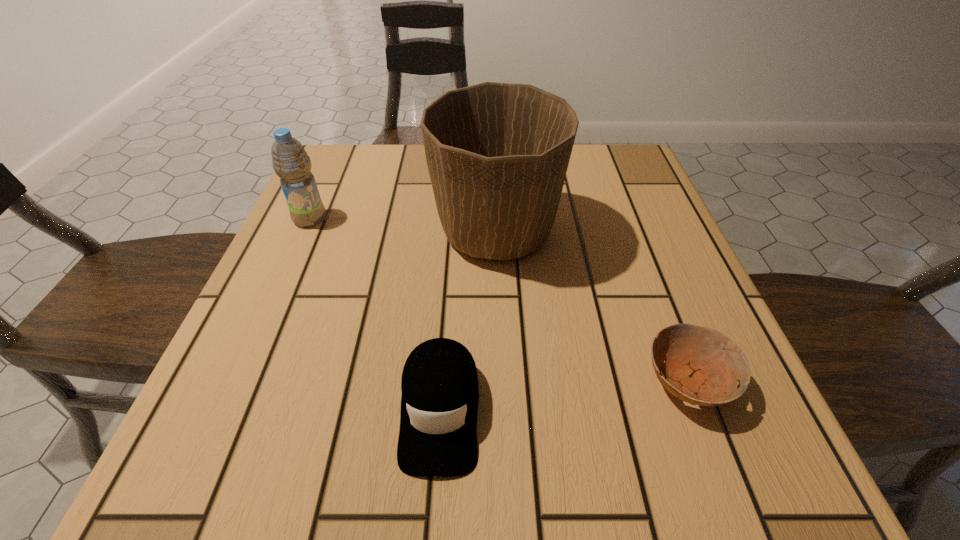
Locate an element on the screen. the tallest object is located at coordinates (497, 154).

The height and width of the screenshot is (540, 960). Find the location of `water bottle`. water bottle is located at coordinates (290, 161).

Find the location of `the leftmost object`. the leftmost object is located at coordinates (290, 161).

You are a GUI agent. You are given a task and a screenshot of the screen. Output one action in this format:
    pyautogui.click(x=<x>, y=<y>)
    Task: Click on the third tallest object
    The height and width of the screenshot is (540, 960).
    Given the screenshot: What is the action you would take?
    pyautogui.click(x=440, y=393)

I want to click on bowl, so click(699, 360).

The height and width of the screenshot is (540, 960). I want to click on the rightmost object, so click(x=699, y=360).

The image size is (960, 540). What are the coordinates of `vacant space located 0.160m on the right of the flowerpot` in the screenshot? It's located at (639, 232).

Where is `free location located 0.120m on the front of the water bottle`? The height and width of the screenshot is (540, 960). free location located 0.120m on the front of the water bottle is located at coordinates (287, 271).

The height and width of the screenshot is (540, 960). What are the coordinates of `vacant area situated on the back of the rightmost object` in the screenshot? It's located at (636, 249).

In order to click on object that is at the far edge in this screenshot , I will do `click(497, 154)`.